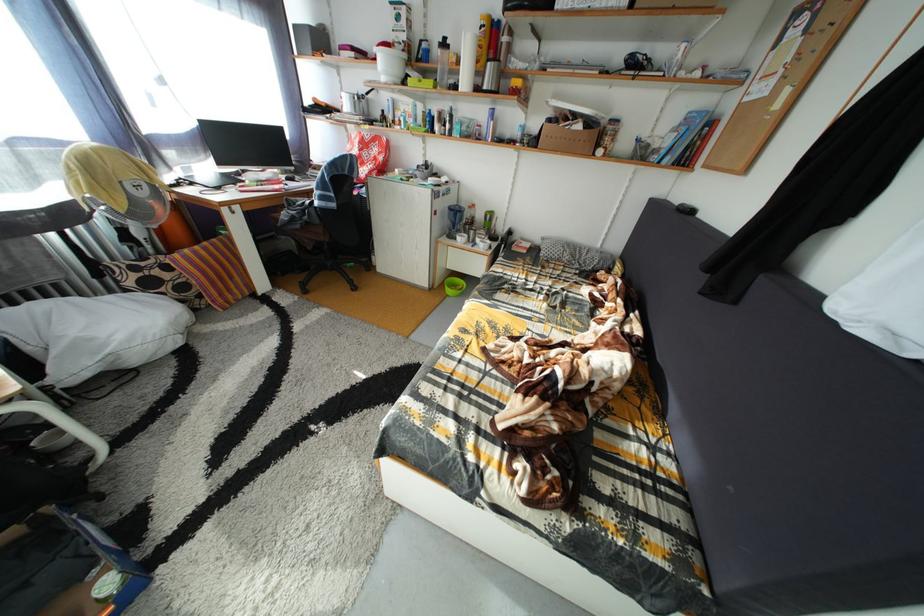
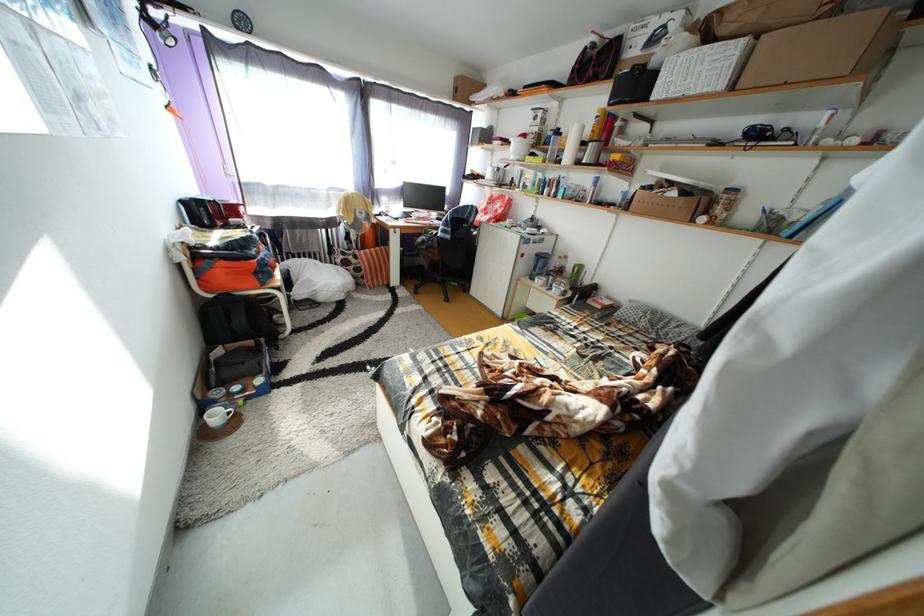
In the second image, find the point that corresponds to (x=525, y=243) in the first image.

(611, 300)